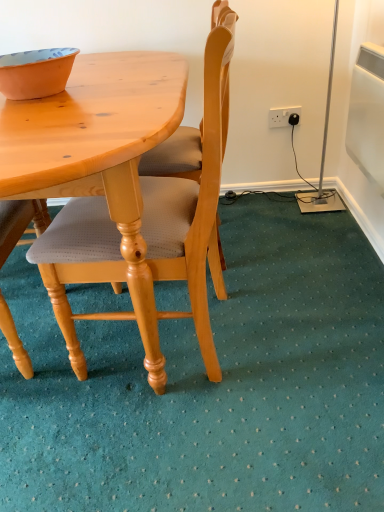
Question: Is orange matte bowl at upper left smaller than white plastic power outlet at upper right?

Choices:
 (A) yes
 (B) no

Answer: (B)

Question: Considering the relative sizes of orange matte bowl at upper left and white plastic power outlet at upper right in the image provided, is orange matte bowl at upper left thinner than white plastic power outlet at upper right?

Choices:
 (A) no
 (B) yes

Answer: (A)

Question: Can you see orange matte bowl at upper left touching white plastic power outlet at upper right?

Choices:
 (A) no
 (B) yes

Answer: (A)

Question: Can you confirm if orange matte bowl at upper left is bigger than white plastic power outlet at upper right?

Choices:
 (A) no
 (B) yes

Answer: (B)

Question: Is orange matte bowl at upper left shorter than white plastic power outlet at upper right?

Choices:
 (A) yes
 (B) no

Answer: (A)

Question: Could you tell me if orange matte bowl at upper left is turned towards white plastic power outlet at upper right?

Choices:
 (A) yes
 (B) no

Answer: (B)

Question: Does white plastic power outlet at upper right have a greater height compared to orange matte bowl at upper left?

Choices:
 (A) no
 (B) yes

Answer: (B)

Question: From the image's perspective, is white plastic power outlet at upper right beneath orange matte bowl at upper left?

Choices:
 (A) no
 (B) yes

Answer: (A)

Question: Does white plastic power outlet at upper right have a lesser height compared to orange matte bowl at upper left?

Choices:
 (A) no
 (B) yes

Answer: (A)

Question: From a real-world perspective, is white plastic power outlet at upper right positioned under orange matte bowl at upper left based on gravity?

Choices:
 (A) no
 (B) yes

Answer: (B)

Question: Is white plastic power outlet at upper right not within orange matte bowl at upper left?

Choices:
 (A) no
 (B) yes

Answer: (B)

Question: Can orange matte bowl at upper left be found inside white plastic power outlet at upper right?

Choices:
 (A) yes
 (B) no

Answer: (B)

Question: Considering the relative sizes of light wood/light brown chair at center and orange matte bowl at upper left in the image provided, is light wood/light brown chair at center taller than orange matte bowl at upper left?

Choices:
 (A) no
 (B) yes

Answer: (B)